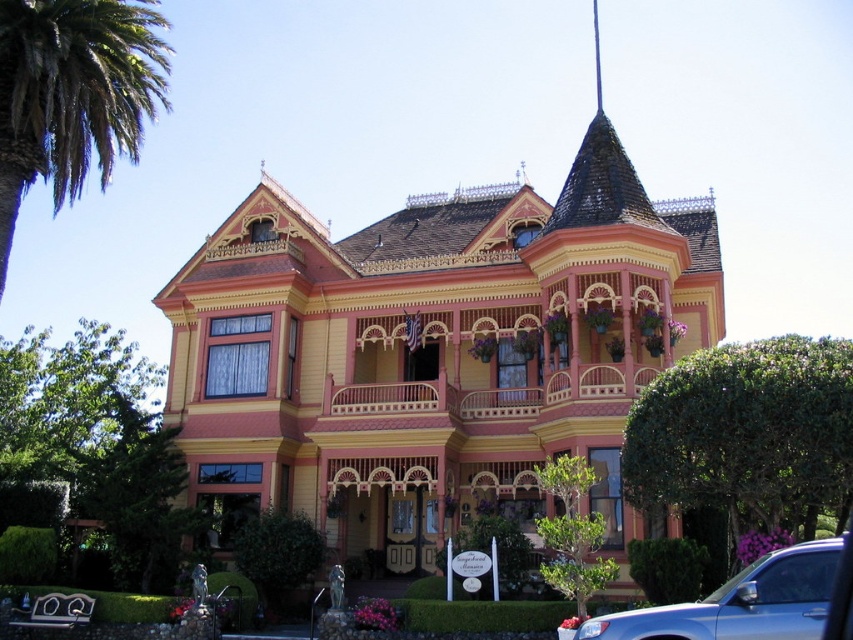
From the picture: Is green leafy palm at upper left shorter than blue metallic car at lower right?

No, green leafy palm at upper left is not shorter than blue metallic car at lower right.

Which is above, green leafy palm at upper left or blue metallic car at lower right?

Positioned higher is green leafy palm at upper left.

Which is behind, point (73, 179) or point (811, 550)?

The point (73, 179) is behind.

Where is `green leafy palm at upper left`? green leafy palm at upper left is located at coordinates (73, 93).